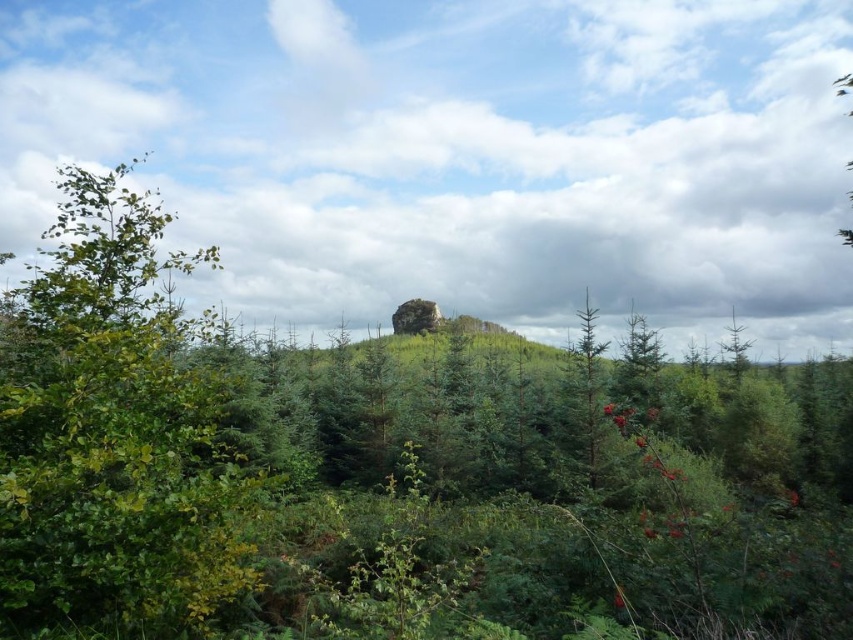
You are an observer looking at the landscape. Which object is positioned higher in the sky between the white fluffy cloud at upper center and the green leafy tree at left?

The white fluffy cloud at upper center is positioned higher in the sky than the green leafy tree at left.

You are an artist sketching this landscape and want to ensure the white fluffy cloud at upper center and the green matte tree at center are proportionally accurate. Which object should you draw wider in your sketch?

The white fluffy cloud at upper center should be drawn wider than the green matte tree at center because its width surpasses the tree.